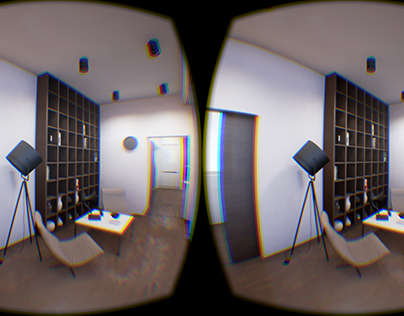
You are a GUI agent. You are given a task and a screenshot of the screen. Output one action in this format:
    pyautogui.click(x=<x>, y=<y>)
    Task: Click on the book case
    The image size is (404, 316).
    Given the screenshot: What is the action you would take?
    pyautogui.click(x=353, y=128), pyautogui.click(x=68, y=130)